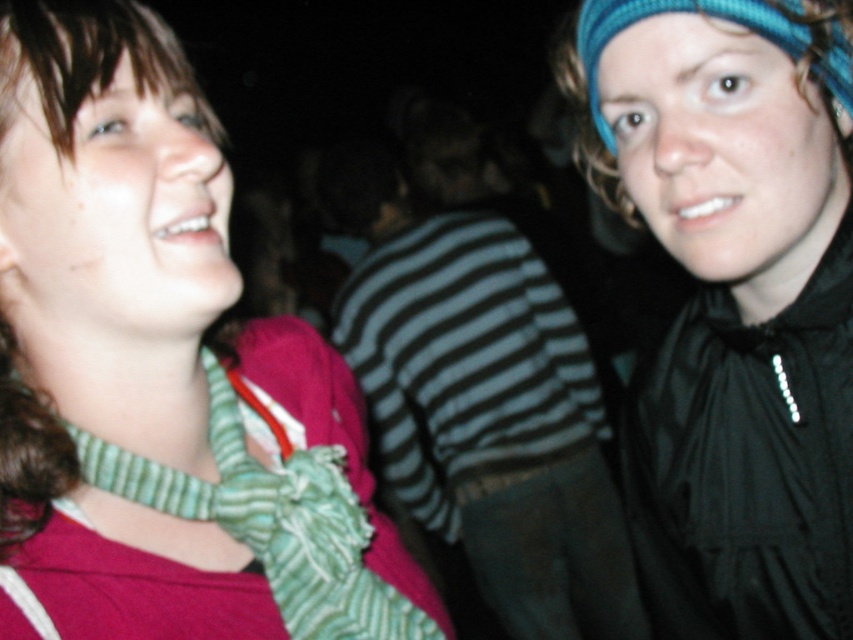
Can you confirm if green striped scarf at left is positioned to the right of blue knitted headscarf at upper right?

No, green striped scarf at left is not to the right of blue knitted headscarf at upper right.

This screenshot has width=853, height=640. What are the coordinates of `green striped scarf at left` in the screenshot? It's located at (276, 524).

Identify the location of green striped scarf at left. (276, 524).

The width and height of the screenshot is (853, 640). Find the location of `green striped scarf at left`. green striped scarf at left is located at coordinates (276, 524).

Can you confirm if blue knitted headband at upper right is positioned above blue knitted headscarf at upper right?

No.

Does point (695, 410) lie in front of point (606, 24)?

No, it is behind (606, 24).

Where is `blue knitted headband at upper right`? Image resolution: width=853 pixels, height=640 pixels. blue knitted headband at upper right is located at coordinates (734, 298).

You are a GUI agent. You are given a task and a screenshot of the screen. Output one action in this format:
    pyautogui.click(x=<x>, y=<y>)
    Task: Click on the blue knitted headband at upper right
    This screenshot has width=853, height=640.
    Given the screenshot: What is the action you would take?
    pyautogui.click(x=734, y=298)

Is point (532, 381) closer to viewer compared to point (366, 552)?

No, (532, 381) is further to viewer.

Is striped fabric shirt at center taller than green striped scarf at left?

Yes.

Describe the element at coordinates (485, 406) in the screenshot. I see `striped fabric shirt at center` at that location.

You are a GUI agent. You are given a task and a screenshot of the screen. Output one action in this format:
    pyautogui.click(x=<x>, y=<y>)
    Task: Click on the striped fabric shirt at center
    The image size is (853, 640).
    Given the screenshot: What is the action you would take?
    pyautogui.click(x=485, y=406)